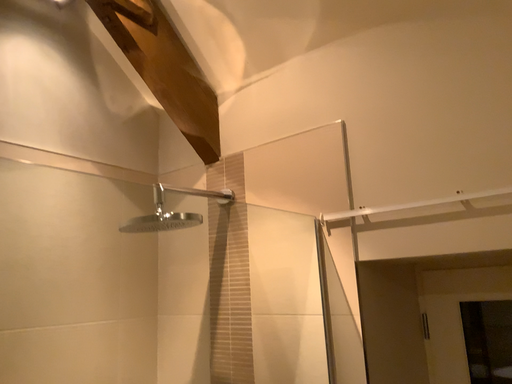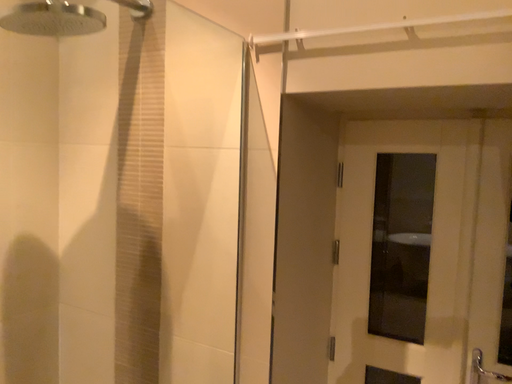
Question: Which way did the camera rotate in the video?

Choices:
 (A) rotated right
 (B) rotated left

Answer: (A)